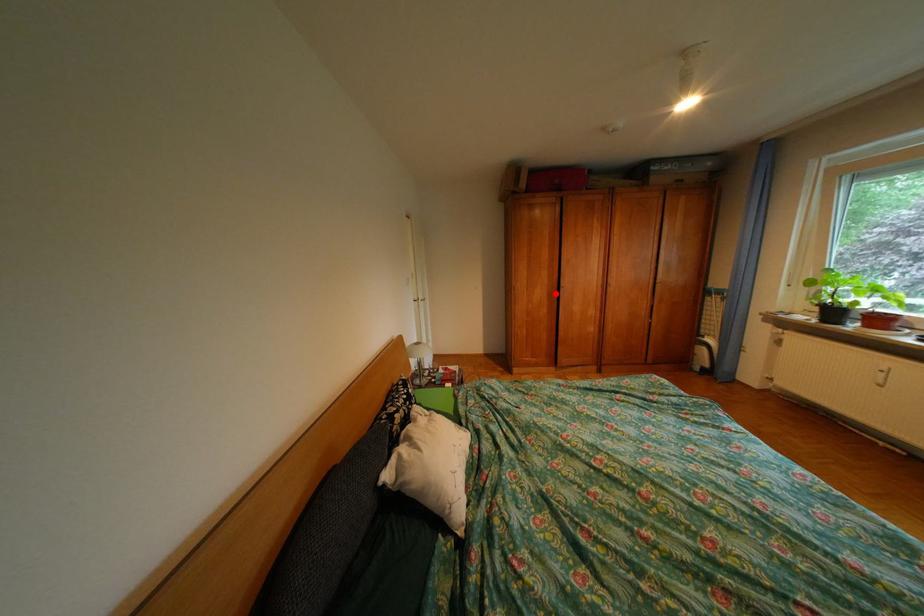
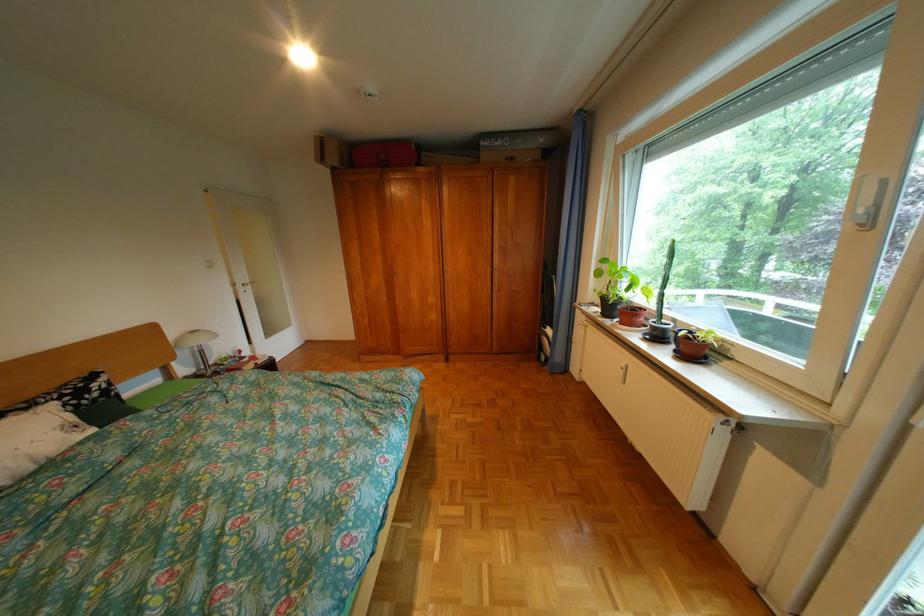
Locate, in the second image, the point that corresponds to the highlighted location in the first image.

(392, 280)